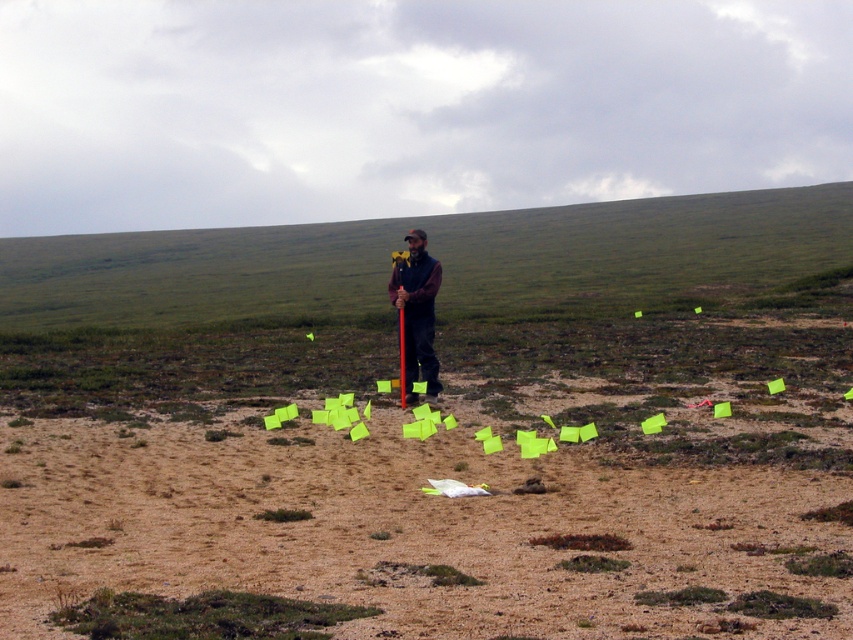
Which of these two, brown sandy dirt at lower center or dark blue fabric jacket at center, stands shorter?

With less height is brown sandy dirt at lower center.

Which of these two, brown sandy dirt at lower center or dark blue fabric jacket at center, stands taller?

dark blue fabric jacket at center

Who is more forward, [621,529] or [410,380]?

Positioned in front is point [621,529].

At what (x,y) coordinates should I click in order to perform the action: click on brown sandy dirt at lower center. Please return your answer as a coordinate pair (x, y). The height and width of the screenshot is (640, 853). Looking at the image, I should click on (401, 529).

Does dark blue fabric jacket at center appear on the right side of metallic pole at center?

Correct, you'll find dark blue fabric jacket at center to the right of metallic pole at center.

The image size is (853, 640). Describe the element at coordinates (416, 314) in the screenshot. I see `dark blue fabric jacket at center` at that location.

Identify the location of dark blue fabric jacket at center. This screenshot has height=640, width=853. (416, 314).

Does brown sandy dirt at lower center have a smaller size compared to metallic pole at center?

Correct, brown sandy dirt at lower center occupies less space than metallic pole at center.

This screenshot has width=853, height=640. What do you see at coordinates (401, 529) in the screenshot? I see `brown sandy dirt at lower center` at bounding box center [401, 529].

Locate an element on the screen. The image size is (853, 640). brown sandy dirt at lower center is located at coordinates (401, 529).